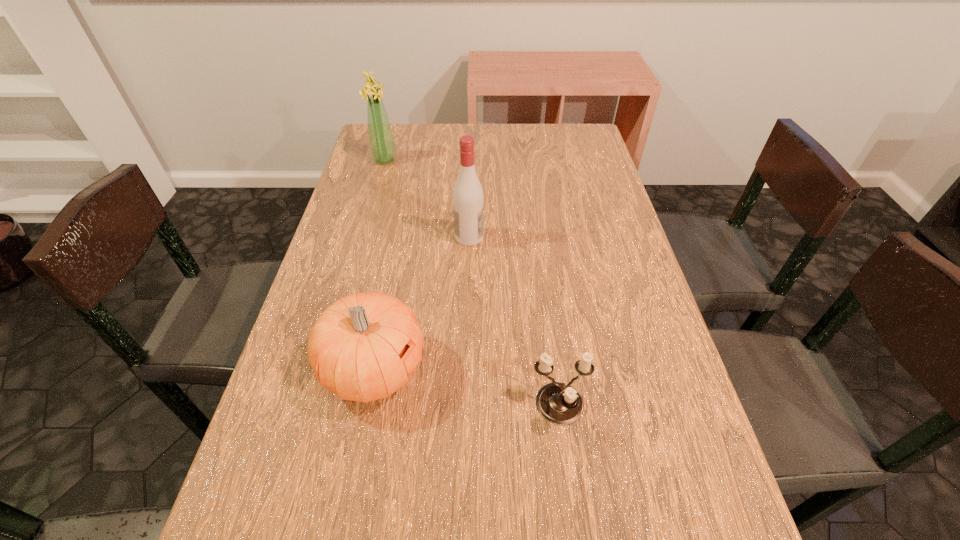
Where is `unoccupied area between the third nearest object and the rightmost object`? The width and height of the screenshot is (960, 540). unoccupied area between the third nearest object and the rightmost object is located at coordinates (515, 322).

Locate an element on the screen. Image resolution: width=960 pixels, height=540 pixels. free space between the alcohol and the shortest object is located at coordinates coord(515,322).

Choose which object is the second nearest neighbor to the alcohol. Please provide its 2D coordinates. Your answer should be formatted as a tuple, i.e. [(x, y)], where the tuple contains the x and y coordinates of a point satisfying the conditions above.

[(382, 146)]

Identify which object is the third nearest to the second shortest object. Please provide its 2D coordinates. Your answer should be formatted as a tuple, i.e. [(x, y)], where the tuple contains the x and y coordinates of a point satisfying the conditions above.

[(382, 146)]

The image size is (960, 540). I want to click on free location that satisfies the following two spatial constraints: 1. on the back side of the rightmost object; 2. on the label of the third object from left to right, so (x=537, y=237).

Where is `vacant position in the image that satisfies the following two spatial constraints: 1. on the back side of the shortest object; 2. on the label of the second farthest object`? Image resolution: width=960 pixels, height=540 pixels. vacant position in the image that satisfies the following two spatial constraints: 1. on the back side of the shortest object; 2. on the label of the second farthest object is located at coordinates (537, 237).

At what (x,y) coordinates should I click in order to perform the action: click on free spot that satisfies the following two spatial constraints: 1. on the label of the third nearest object; 2. on the back side of the shortest object. Please return your answer as a coordinate pair (x, y). This screenshot has width=960, height=540. Looking at the image, I should click on (465, 407).